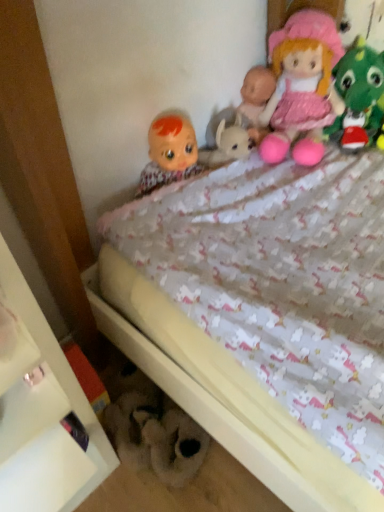
The height and width of the screenshot is (512, 384). What do you see at coordinates (359, 98) in the screenshot?
I see `pink fabric doll at upper right, the 1th toy from the top` at bounding box center [359, 98].

Measure the distance between point (298, 33) and camera.

Point (298, 33) and camera are 3.72 feet apart from each other.

The width and height of the screenshot is (384, 512). Find the location of `fluffy white teddy bear at lower center, the second toy positioned from the top`. fluffy white teddy bear at lower center, the second toy positioned from the top is located at coordinates (156, 436).

Locate an element on the screen. white glossy shelf at lower left is located at coordinates (41, 410).

You are a GUI agent. You are given a task and a screenshot of the screen. Output one action in this format:
    pyautogui.click(x=<x>, y=<y>)
    Task: Click on the matte plastic doll at upper left, the first doll in the left-to-right sequence
    The image size is (384, 512).
    Given the screenshot: What is the action you would take?
    pos(170,152)

Based on the photo, is fluffy white teddy bear at lower center, the 2th toy from the right, surrounded by pink fabric doll at upper right, the 1th toy from the top?

Actually, fluffy white teddy bear at lower center, the 2th toy from the right, is outside pink fabric doll at upper right, the 1th toy from the top.

Considering the points (349, 73) and (128, 403), which point is in front, point (349, 73) or point (128, 403)?

Positioned in front is point (128, 403).

The height and width of the screenshot is (512, 384). There is a fluffy white teddy bear at lower center, the 2th toy from the right. Find the location of `toy above it (from a real-world perspective)`. toy above it (from a real-world perspective) is located at coordinates (359, 98).

Is pink fabric doll at upper right, the second toy when ordered from bottom to top, shorter than matte plastic doll at upper left, the 2th doll viewed from the right?

No, pink fabric doll at upper right, the second toy when ordered from bottom to top, is not shorter than matte plastic doll at upper left, the 2th doll viewed from the right.

Does pink fabric doll at upper right, the second toy when ordered from bottom to top, have a greater width compared to matte plastic doll at upper left, the 2th doll viewed from the right?

Indeed, pink fabric doll at upper right, the second toy when ordered from bottom to top, has a greater width compared to matte plastic doll at upper left, the 2th doll viewed from the right.

Consider the image. What's the angular difference between pink fabric doll at upper right, which appears as the second toy when viewed from the left, and matte plastic doll at upper left, the 2th doll viewed from the right,'s facing directions?

The angular difference between pink fabric doll at upper right, which appears as the second toy when viewed from the left, and matte plastic doll at upper left, the 2th doll viewed from the right, is 88.5 degrees.

Identify the location of the 2nd toy counting from the right of the matte plastic doll at upper left, the 2th doll viewed from the right. (359, 98).

From the image's perspective, which is above, matte plastic doll at upper left, the 2th doll viewed from the right, or fluffy white teddy bear at lower center, the first toy ordered from the bottom?

From the image's view, matte plastic doll at upper left, the 2th doll viewed from the right, is above.

Considering the positions of point (162, 177) and point (163, 405), is point (162, 177) closer or farther from the camera than point (163, 405)?

Point (162, 177) appears to be farther away from the viewer than point (163, 405).

Can you confirm if matte plastic doll at upper left, the 2th doll viewed from the right, is shorter than fluffy white teddy bear at lower center, which ranks as the 1th toy in left-to-right order?

Incorrect, the height of matte plastic doll at upper left, the 2th doll viewed from the right, does not fall short of that of fluffy white teddy bear at lower center, which ranks as the 1th toy in left-to-right order.

Is pink fabric doll at upper right, the second toy when ordered from bottom to top, positioned behind pink fabric doll at upper right, placed as the second doll when sorted from left to right?

Yes, pink fabric doll at upper right, the second toy when ordered from bottom to top, is further from the camera.

Which of these two, pink fabric doll at upper right, the second toy when ordered from bottom to top, or pink fabric doll at upper right, which is counted as the 1th doll, starting from the right, is wider?

pink fabric doll at upper right, which is counted as the 1th doll, starting from the right.

Considering the sizes of objects pink fabric doll at upper right, the 1th toy from the top, and pink fabric doll at upper right, which is counted as the 1th doll, starting from the right, in the image provided, who is smaller, pink fabric doll at upper right, the 1th toy from the top, or pink fabric doll at upper right, which is counted as the 1th doll, starting from the right,?

pink fabric doll at upper right, the 1th toy from the top.

Which object is positioned more to the right, white glossy shelf at lower left or fluffy white teddy bear at lower center, the 2th toy from the right?

From the viewer's perspective, fluffy white teddy bear at lower center, the 2th toy from the right, appears more on the right side.

Is white glossy shelf at lower left wider than fluffy white teddy bear at lower center, which ranks as the 1th toy in left-to-right order?

Correct, the width of white glossy shelf at lower left exceeds that of fluffy white teddy bear at lower center, which ranks as the 1th toy in left-to-right order.

Can fluffy white teddy bear at lower center, the 2th toy from the right, be found inside white glossy shelf at lower left?

No.

Considering the positions of objects white glossy shelf at lower left and matte plastic doll at upper left, the first doll in the left-to-right sequence, in the image provided, who is in front, white glossy shelf at lower left or matte plastic doll at upper left, the first doll in the left-to-right sequence,?

white glossy shelf at lower left is more forward.

In terms of size, does white glossy shelf at lower left appear bigger or smaller than matte plastic doll at upper left, the first doll in the left-to-right sequence?

Considering their sizes, white glossy shelf at lower left takes up more space than matte plastic doll at upper left, the first doll in the left-to-right sequence.

The image size is (384, 512). I want to click on the 1st doll above the white glossy shelf at lower left (from the image's perspective), so point(170,152).

From the image's perspective, which object appears higher, white glossy shelf at lower left or matte plastic doll at upper left, the 2th doll viewed from the right?

matte plastic doll at upper left, the 2th doll viewed from the right, appears higher in the image.

Considering the relative sizes of pink fabric doll at upper right, placed as the second doll when sorted from left to right, and fluffy white teddy bear at lower center, which ranks as the 1th toy in left-to-right order, in the image provided, is pink fabric doll at upper right, placed as the second doll when sorted from left to right, shorter than fluffy white teddy bear at lower center, which ranks as the 1th toy in left-to-right order,?

No, pink fabric doll at upper right, placed as the second doll when sorted from left to right, is not shorter than fluffy white teddy bear at lower center, which ranks as the 1th toy in left-to-right order.

From the picture: Is pink fabric doll at upper right, which is counted as the 1th doll, starting from the right, next to fluffy white teddy bear at lower center, the second toy positioned from the top?

There is a gap between pink fabric doll at upper right, which is counted as the 1th doll, starting from the right, and fluffy white teddy bear at lower center, the second toy positioned from the top.

Which object is positioned more to the right, pink fabric doll at upper right, placed as the second doll when sorted from left to right, or fluffy white teddy bear at lower center, which ranks as the 1th toy in left-to-right order?

Positioned to the right is pink fabric doll at upper right, placed as the second doll when sorted from left to right.

Is pink fabric doll at upper right, which is counted as the 1th doll, starting from the right, not within fluffy white teddy bear at lower center, the second toy positioned from the top?

Yes.

In the image, there is a pink fabric doll at upper right, the 1th toy from the top. Identify the location of toy below it (from a real-world perspective). (156, 436).

Locate an element on the screen. The image size is (384, 512). toy above the matte plastic doll at upper left, the first doll in the left-to-right sequence (from a real-world perspective) is located at coordinates (359, 98).

Estimate the real-world distances between objects in this image. Which object is further from white glossy shelf at lower left, fluffy white teddy bear at lower center, which ranks as the 1th toy in left-to-right order, or matte plastic doll at upper left, the first doll in the left-to-right sequence?

matte plastic doll at upper left, the first doll in the left-to-right sequence, is further to white glossy shelf at lower left.

Which object lies nearer to the anchor point pink fabric doll at upper right, which is counted as the 1th toy, starting from the right, pink fabric doll at upper right, which is counted as the 1th doll, starting from the right, or matte plastic doll at upper left, the first doll in the left-to-right sequence?

pink fabric doll at upper right, which is counted as the 1th doll, starting from the right, lies closer to pink fabric doll at upper right, which is counted as the 1th toy, starting from the right, than the other object.

When comparing their distances from pink fabric doll at upper right, which is counted as the 1th doll, starting from the right, does matte plastic doll at upper left, the 2th doll viewed from the right, or white glossy shelf at lower left seem further?

white glossy shelf at lower left is further to pink fabric doll at upper right, which is counted as the 1th doll, starting from the right.

From the image, which object appears to be farther from pink fabric doll at upper right, which is counted as the 1th toy, starting from the right, fluffy white teddy bear at lower center, the second toy positioned from the top, or white glossy shelf at lower left?

white glossy shelf at lower left.

Looking at the image, which one is located closer to pink fabric doll at upper right, which appears as the second toy when viewed from the left, white glossy shelf at lower left or pink fabric doll at upper right, placed as the second doll when sorted from left to right?

Among the two, pink fabric doll at upper right, placed as the second doll when sorted from left to right, is located nearer to pink fabric doll at upper right, which appears as the second toy when viewed from the left.

When comparing their distances from pink fabric doll at upper right, which is counted as the 1th doll, starting from the right, does pink fabric doll at upper right, the second toy when ordered from bottom to top, or fluffy white teddy bear at lower center, the second toy positioned from the top, seem further?

The object further to pink fabric doll at upper right, which is counted as the 1th doll, starting from the right, is fluffy white teddy bear at lower center, the second toy positioned from the top.

Estimate the real-world distances between objects in this image. Which object is closer to pink fabric doll at upper right, placed as the second doll when sorted from left to right, matte plastic doll at upper left, the 2th doll viewed from the right, or pink fabric doll at upper right, which appears as the second toy when viewed from the left?

pink fabric doll at upper right, which appears as the second toy when viewed from the left.

Looking at the image, which one is located closer to pink fabric doll at upper right, placed as the second doll when sorted from left to right, fluffy white teddy bear at lower center, the 2th toy from the right, or white glossy shelf at lower left?

Based on the image, fluffy white teddy bear at lower center, the 2th toy from the right, appears to be nearer to pink fabric doll at upper right, placed as the second doll when sorted from left to right.

The image size is (384, 512). Find the location of `toy that lies between pink fabric doll at upper right, placed as the second doll when sorted from left to right, and fluffy white teddy bear at lower center, the first toy ordered from the bottom, from top to bottom`. toy that lies between pink fabric doll at upper right, placed as the second doll when sorted from left to right, and fluffy white teddy bear at lower center, the first toy ordered from the bottom, from top to bottom is located at coordinates pyautogui.click(x=359, y=98).

Where is `doll between pink fabric doll at upper right, the second toy when ordered from bottom to top, and white glossy shelf at lower left, in the vertical direction`? The width and height of the screenshot is (384, 512). doll between pink fabric doll at upper right, the second toy when ordered from bottom to top, and white glossy shelf at lower left, in the vertical direction is located at coordinates (170, 152).

Image resolution: width=384 pixels, height=512 pixels. What are the coordinates of `doll situated between matte plastic doll at upper left, the first doll in the left-to-right sequence, and pink fabric doll at upper right, the second toy when ordered from bottom to top, from left to right` in the screenshot? It's located at (302, 87).

This screenshot has height=512, width=384. I want to click on doll between pink fabric doll at upper right, placed as the second doll when sorted from left to right, and white glossy shelf at lower left from top to bottom, so click(x=170, y=152).